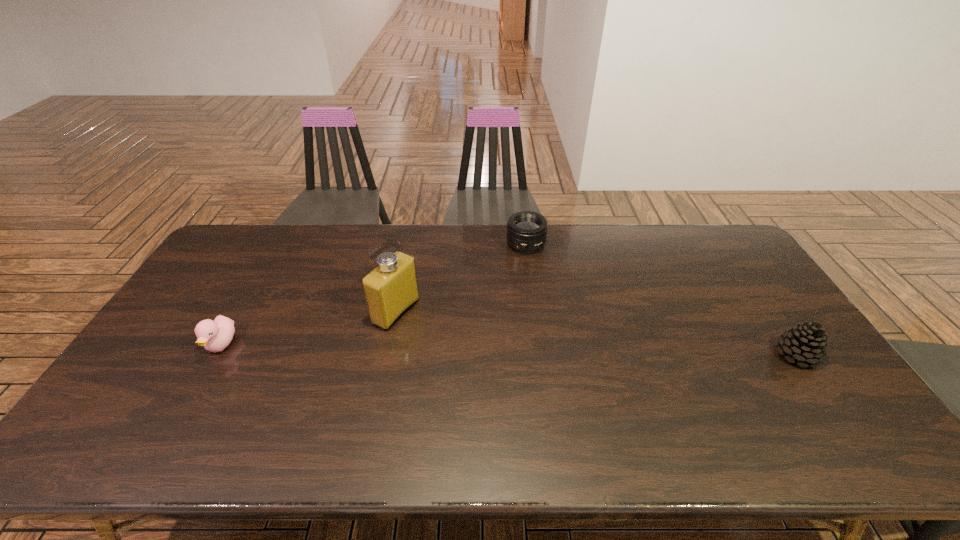
In the image, there is a desktop. Where is `vacant space at the far right corner`? vacant space at the far right corner is located at coordinates (730, 246).

Find the location of a particular element. blank space at the near right corner of the desktop is located at coordinates (786, 390).

This screenshot has width=960, height=540. In order to click on vacant region between the leftmost object and the tallest object in this screenshot , I will do `click(309, 328)`.

Where is `blank region between the second object from right to left and the rightmost object`? The image size is (960, 540). blank region between the second object from right to left and the rightmost object is located at coordinates (661, 299).

In order to click on empty location between the third object from left to right and the tallest object in this screenshot , I will do `click(461, 278)`.

I want to click on vacant space that's between the second object from left to right and the second object from right to left, so click(x=461, y=278).

In order to click on empty location between the rightmost object and the leftmost object in this screenshot , I will do `click(509, 349)`.

Find the location of `free space between the farthest object and the perfume`. free space between the farthest object and the perfume is located at coordinates (461, 278).

Locate an element on the screen. vacant region between the leftmost object and the rightmost object is located at coordinates (509, 349).

Choose which object is the third nearest neighbor to the duckling. Please provide its 2D coordinates. Your answer should be formatted as a tuple, i.e. [(x, y)], where the tuple contains the x and y coordinates of a point satisfying the conditions above.

[(806, 343)]